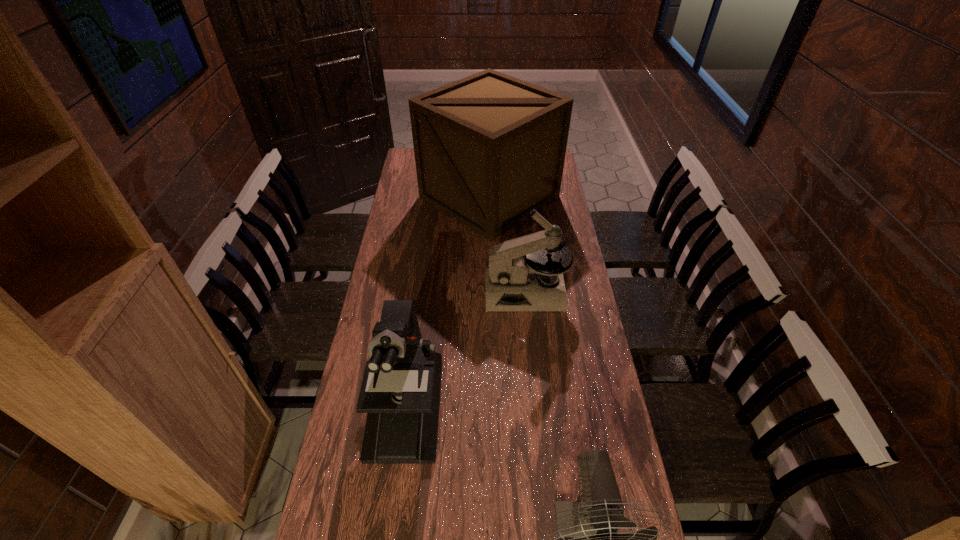
The width and height of the screenshot is (960, 540). In order to click on empty space that is in between the second farthest object and the left microscope in this screenshot , I will do `click(466, 350)`.

Find the location of `object that is the second closest one to the box`. object that is the second closest one to the box is located at coordinates [400, 392].

Locate which object is the third closest to the right microscope. Please provide its 2D coordinates. Your answer should be formatted as a tuple, i.e. [(x, y)], where the tuple contains the x and y coordinates of a point satisfying the conditions above.

[(587, 539)]

You are a GUI agent. You are given a task and a screenshot of the screen. Output one action in this format:
    pyautogui.click(x=<x>, y=<y>)
    Task: Click on the free spot that satisfies the following two spatial constraints: 1. at the eyepiece of the second farthest object; 2. through the eyepieces of the left microscope
    This screenshot has height=540, width=960.
    Given the screenshot: What is the action you would take?
    pyautogui.click(x=538, y=410)